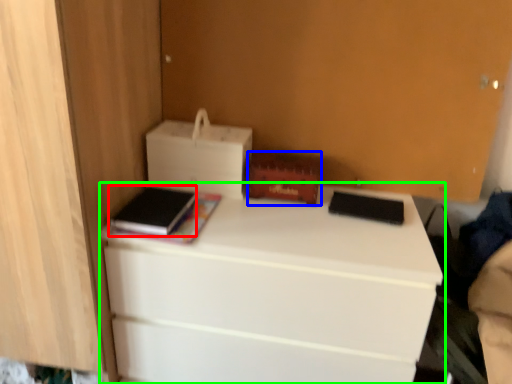
Question: Which object is positioned closest to paperback book (highlighted by a red box)? Select from storage box (highlighted by a blue box) and desk (highlighted by a green box).

Choices:
 (A) storage box
 (B) desk

Answer: (A)